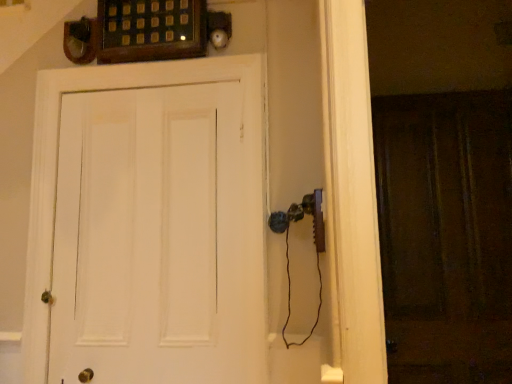
Question: Considering the positions of brown wooden screen door at right and white matte door at center in the image, is brown wooden screen door at right bigger or smaller than white matte door at center?

Choices:
 (A) big
 (B) small

Answer: (B)

Question: Relative to white matte door at center, is brown wooden screen door at right in front or behind?

Choices:
 (A) front
 (B) behind

Answer: (B)

Question: Is brown wooden screen door at right inside the boundaries of white matte door at center, or outside?

Choices:
 (A) inside
 (B) outside

Answer: (B)

Question: Considering the positions of white matte door at center and brown wooden screen door at right in the image, is white matte door at center taller or shorter than brown wooden screen door at right?

Choices:
 (A) tall
 (B) short

Answer: (B)

Question: Looking at their shapes, would you say white matte door at center is wider or thinner than brown wooden screen door at right?

Choices:
 (A) thin
 (B) wide

Answer: (B)

Question: From the image's perspective, is white matte door at center positioned above or below brown wooden screen door at right?

Choices:
 (A) below
 (B) above

Answer: (B)

Question: Choose the correct answer: Is white matte door at center inside brown wooden screen door at right or outside it?

Choices:
 (A) outside
 (B) inside

Answer: (A)